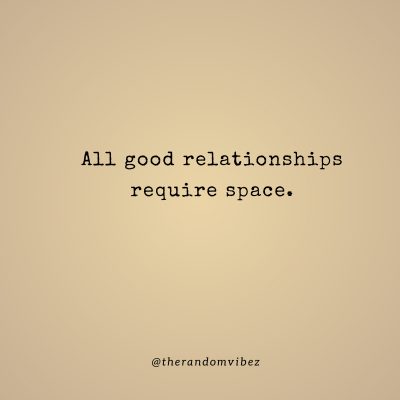
The image size is (400, 400). I want to click on handle, @therandomvibez, so click(x=165, y=362).